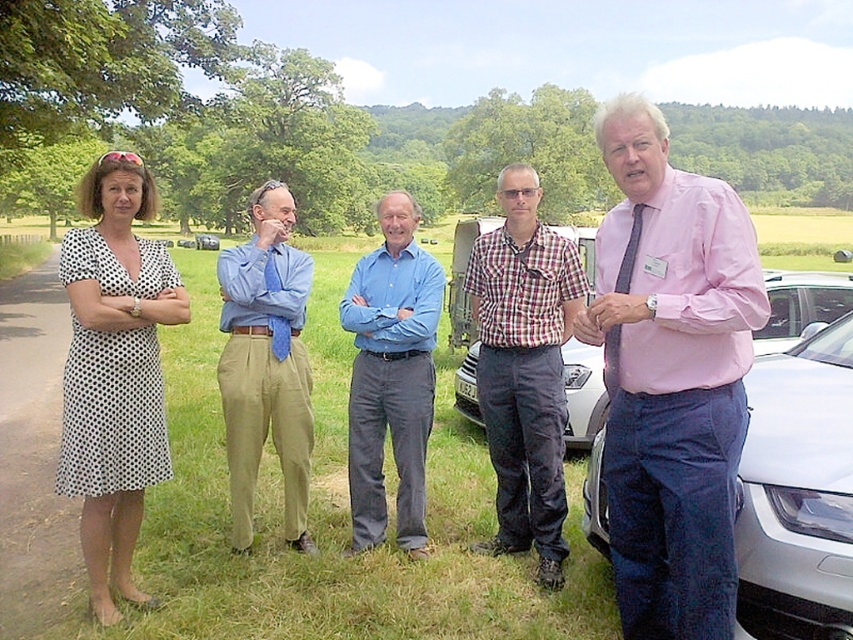
You are standing at the center of the grassy area in the image. You need to locate the white metallic car at right. In which direction should you look to find it?

The white metallic car at right is located to your right side since it is positioned at point (799,305), which corresponds to the right side of the image.

You are a photographer taking a group photo of the plaid shirt at center and the blue cotton shirt at center. Which of the two shirts should you place on the left side to align with their current positions?

The blue cotton shirt at center should be placed on the left side because the plaid shirt at center is positioned on the right side of it.